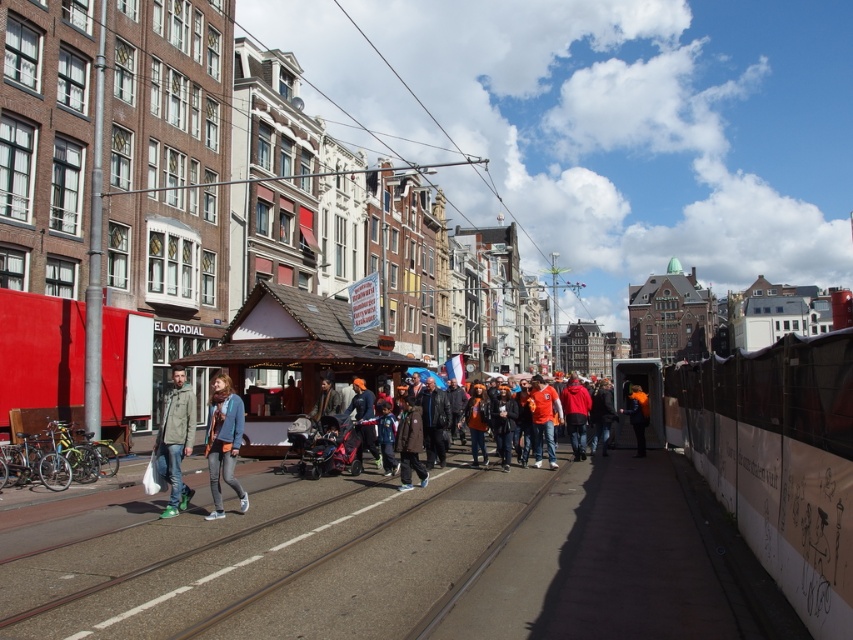
Does camouflage jacket at lower left appear over orange fabric jacket at center?

Yes.

I want to click on camouflage jacket at lower left, so click(175, 440).

Is point (186, 497) closer to viewer compared to point (630, 412)?

That is True.

Find the location of `camouflage jacket at lower left`. camouflage jacket at lower left is located at coordinates (175, 440).

Is dark brown leather jacket at center closer to the viewer compared to orange leather jacket at center?

That is True.

Describe the element at coordinates (410, 444) in the screenshot. The width and height of the screenshot is (853, 640). I see `dark brown leather jacket at center` at that location.

The image size is (853, 640). Find the location of `dark brown leather jacket at center`. dark brown leather jacket at center is located at coordinates (410, 444).

Who is taller, brown concrete train track at center or orange knit hat at center?

With more height is orange knit hat at center.

Is brown concrete train track at center behind orange knit hat at center?

No.

I want to click on brown concrete train track at center, so click(x=277, y=563).